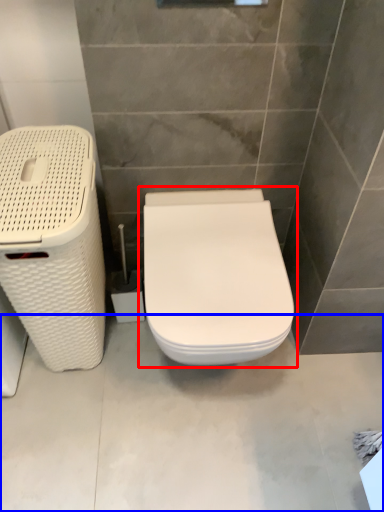
Question: Which object appears farthest to the camera in this image, toilet (highlighted by a red box) or concrete (highlighted by a blue box)?

Choices:
 (A) toilet
 (B) concrete

Answer: (B)